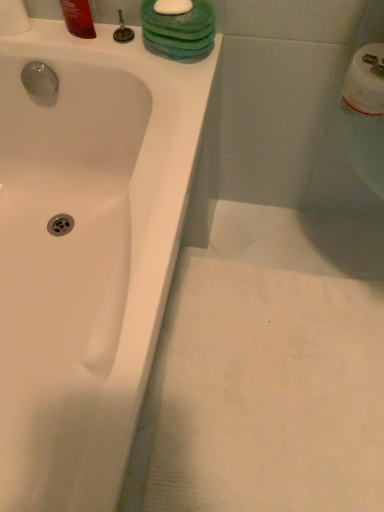
Question: In the image, is matte silver faucet at upper center on the left side or the right side of shiny plastic bottle at upper left?

Choices:
 (A) right
 (B) left

Answer: (A)

Question: From a real-world perspective, relative to shiny plastic bottle at upper left, is matte silver faucet at upper center vertically above or below?

Choices:
 (A) below
 (B) above

Answer: (A)

Question: Which is farther from the matte silver faucet at upper center?

Choices:
 (A) white glossy bathtub at upper left
 (B) shiny plastic bottle at upper left
 (C) white paper towel at upper left

Answer: (A)

Question: Which object is the farthest from the shiny plastic bottle at upper left?

Choices:
 (A) white glossy bathtub at upper left
 (B) white paper towel at upper left
 (C) matte silver faucet at upper center

Answer: (A)